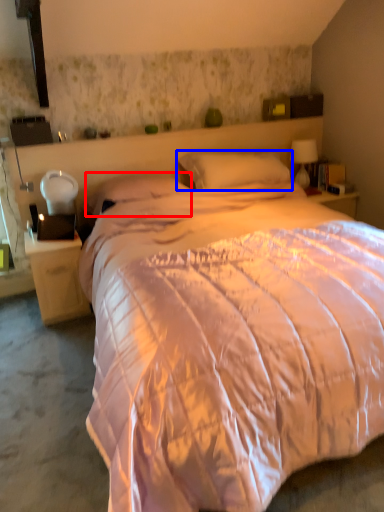
Question: Which of the following is the closest to the observer, pillow (highlighted by a red box) or pillow (highlighted by a blue box)?

Choices:
 (A) pillow
 (B) pillow

Answer: (A)